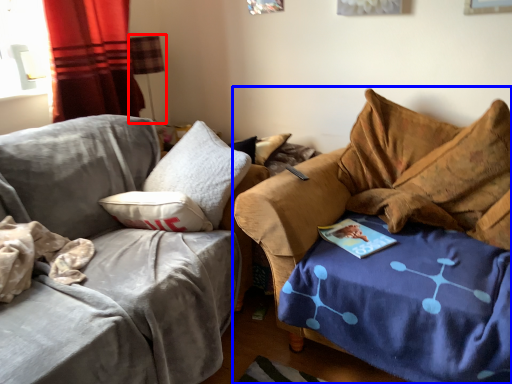
Question: Which of the following is the farthest to the observer, lamp (highlighted by a red box) or studio couch (highlighted by a blue box)?

Choices:
 (A) lamp
 (B) studio couch

Answer: (A)